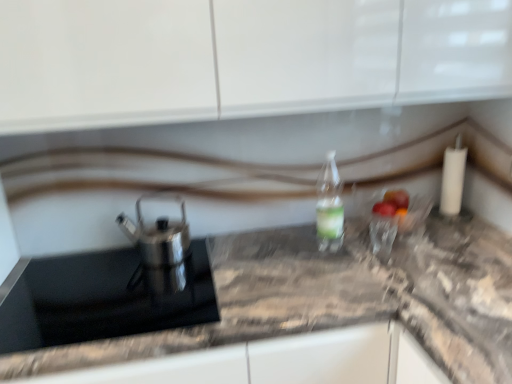
Find the location of `vacant space to the left of clear plastic bottle at center`. vacant space to the left of clear plastic bottle at center is located at coordinates (283, 252).